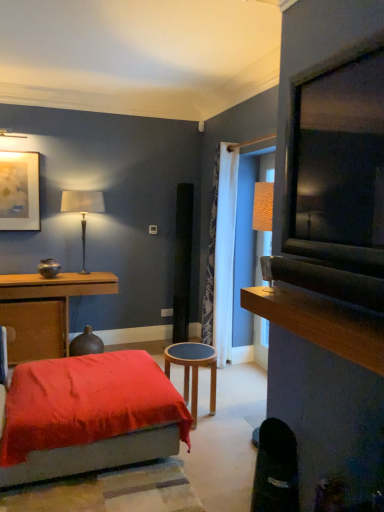
Find the location of a particular element. Image resolution: width=384 pixels, height=512 pixels. free space above velvet red ottoman at lower left (from a real-world perspective) is located at coordinates (86, 375).